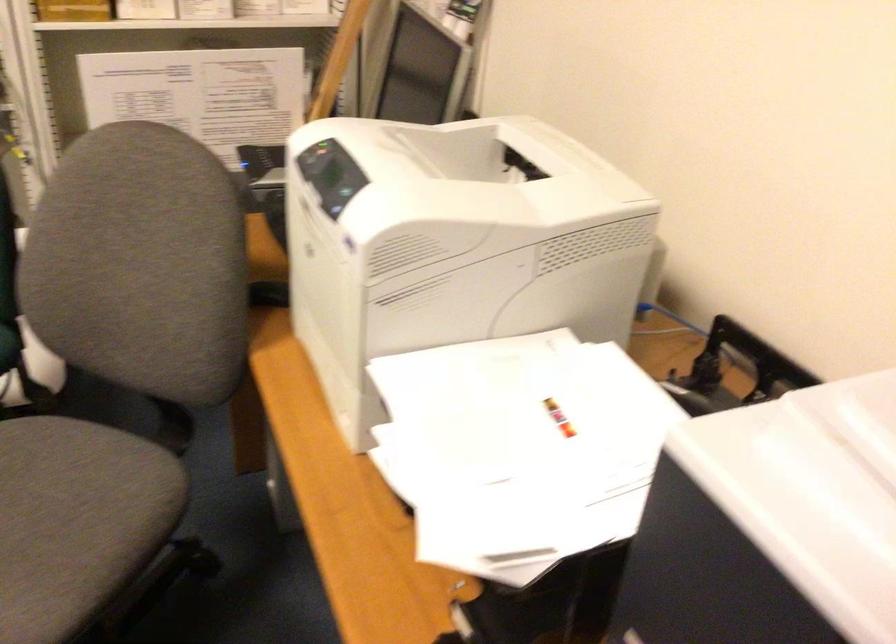
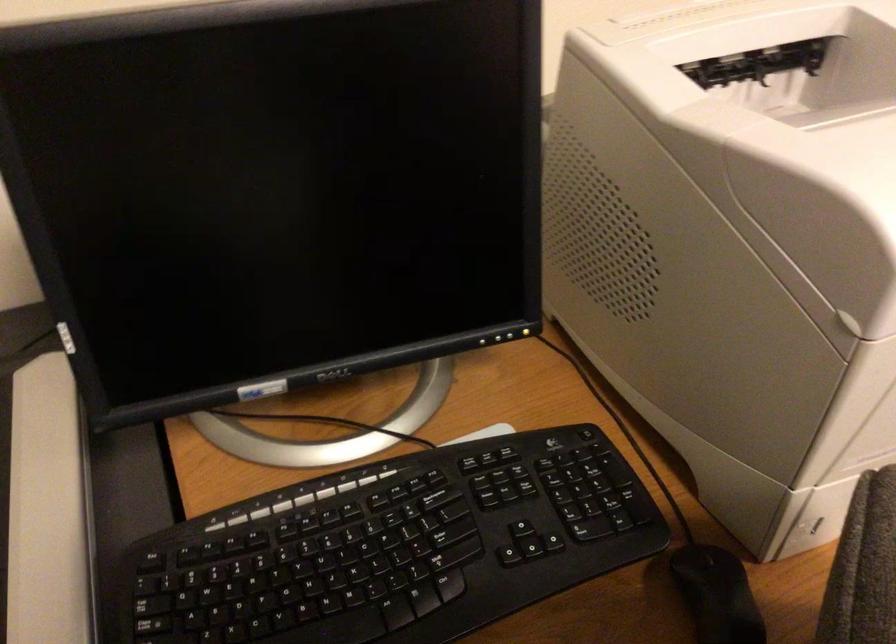
In the second image, find the point that corresponds to point (529, 118) in the first image.

(616, 21)